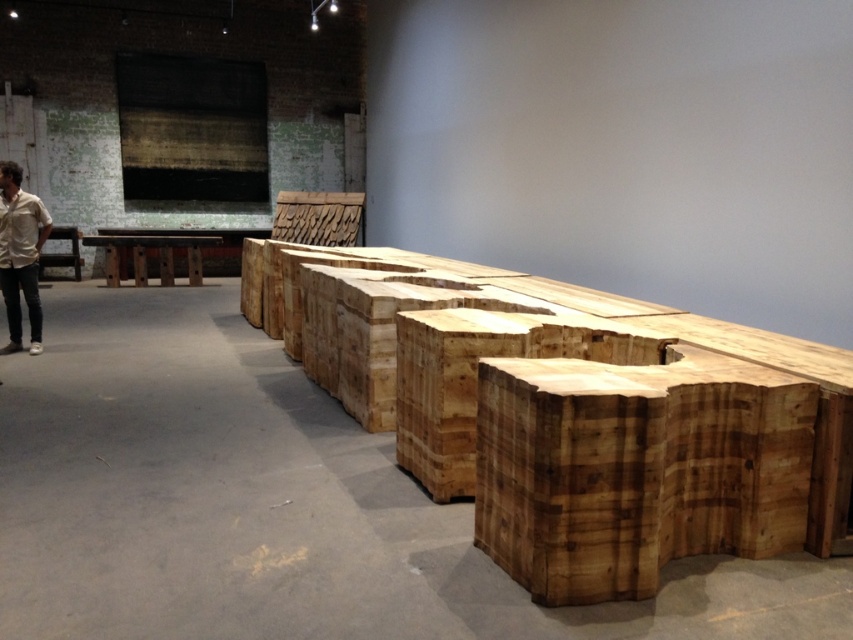
You are an architect designing a new exhibition space and need to place a 1.5 meter long sofa in the same location as the natural wood bench at center. What coordinates should you use for placement?

The natural wood bench at center is located at coordinates point (570, 412), so the sofa should be placed at those coordinates.

You are an art curator in the gallery and need to place a new sculpture. The sculpture is 2 meters wide. The white shirt at left and natural wood table at center are in the way. Can you move the sculpture between them?

The white shirt at left is to the right of the natural wood table at center, so there is space between them. Since the sculpture is 2 meters wide, you need to ensure the distance between the white shirt at left and natural wood table at center is at least 2 meters. However, without knowing the exact distance, it is uncertain if the sculpture can fit. Check the space between them first.

You are standing in the gallery and want to touch the white shirt at left and the wooden bench at left. Which object will you reach first?

The white shirt at left is closer to the viewer than the wooden bench at left, so you will reach the white shirt at left first.